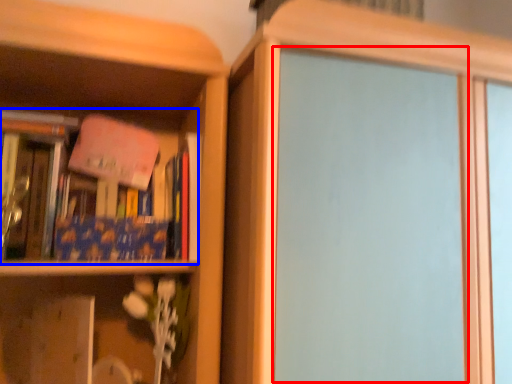
Question: Among these objects, which one is nearest to the camera, screen door (highlighted by a red box) or book (highlighted by a blue box)?

Choices:
 (A) screen door
 (B) book

Answer: (A)